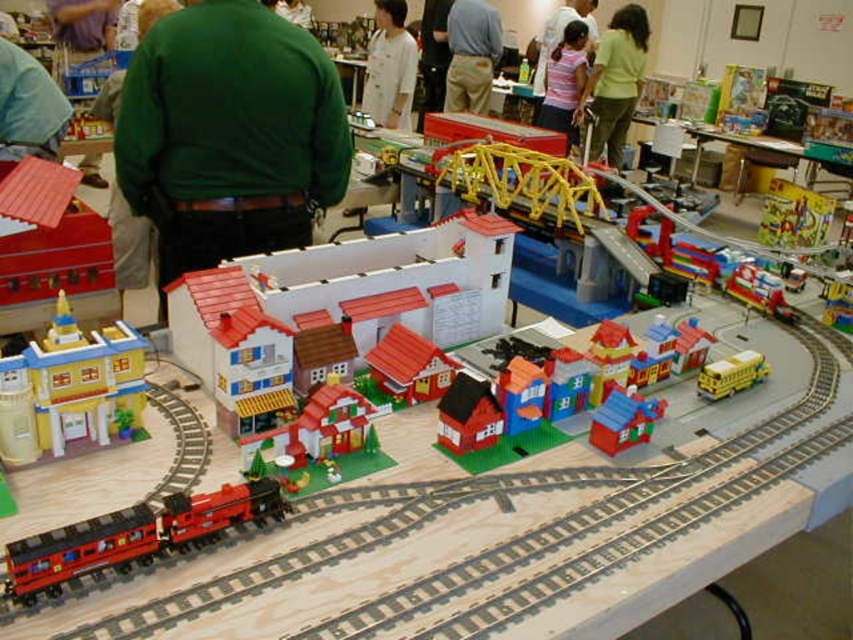
In the scene shown: You are standing in front of the model train set and want to take a photo. You notice two points marked on the display. The first point is at coordinate point (393, 35), and the second is at point (546, 28). Which point will appear closer to the camera in your photo?

Point (393, 35) is closer to the camera than point (546, 28), so it will appear closer in the photo.

You are a photographer at the event and need to capture a clear photo of both the white smooth shirt at center and the pink cotton shirt at upper center. Based on their sizes, which shirt might be easier to fit into the frame without cropping?

The white smooth shirt at center occupies less space than the pink cotton shirt at upper center, so it might be easier to fit into the frame without cropping.

You are a visitor at the exhibition and want to take a photo of the yellow plastic building at left and the green matte shirt at upper center. Which object should you focus on first if you want to capture both in a single frame without moving the camera?

The yellow plastic building at left is thinner than the green matte shirt at upper center, so you should focus on the green matte shirt at upper center first since it is wider and will require more space in the frame.